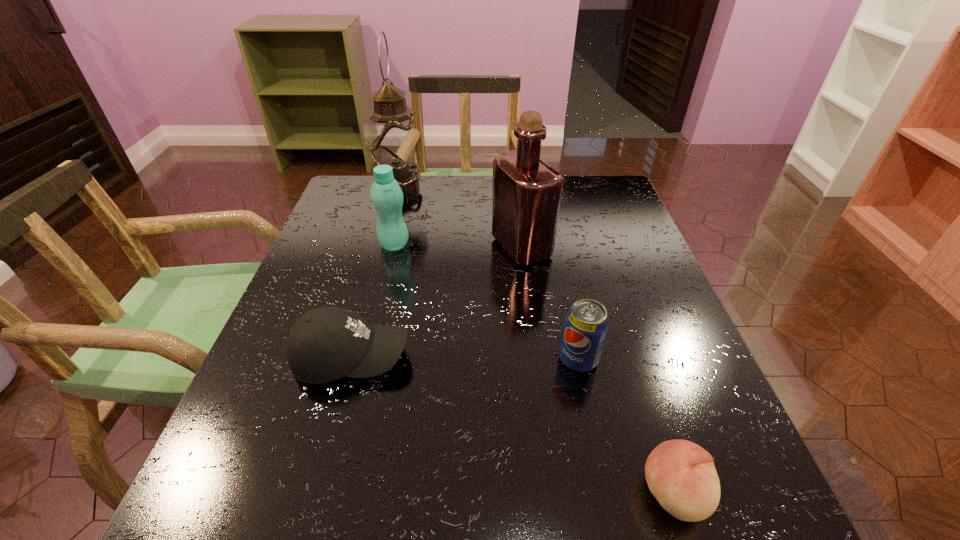
The height and width of the screenshot is (540, 960). Find the location of `the tallest object`. the tallest object is located at coordinates (394, 141).

Where is `oil lamp`? oil lamp is located at coordinates (394, 141).

Image resolution: width=960 pixels, height=540 pixels. In order to click on the second tallest object in this screenshot , I will do `click(527, 192)`.

At what (x,y) coordinates should I click in order to perform the action: click on bottle. Please return your answer as a coordinate pair (x, y). The image size is (960, 540). Looking at the image, I should click on (387, 197).

This screenshot has width=960, height=540. Identify the location of soda. (586, 324).

Where is `baseball cap`? The width and height of the screenshot is (960, 540). baseball cap is located at coordinates (325, 344).

Image resolution: width=960 pixels, height=540 pixels. Identify the location of peach. (681, 475).

Image resolution: width=960 pixels, height=540 pixels. I want to click on the shortest object, so click(681, 475).

Identify the location of vacant area situated on the right of the oil lamp. (537, 188).

Image resolution: width=960 pixels, height=540 pixels. Identify the location of free space located 0.200m on the back of the second tallest object. (515, 188).